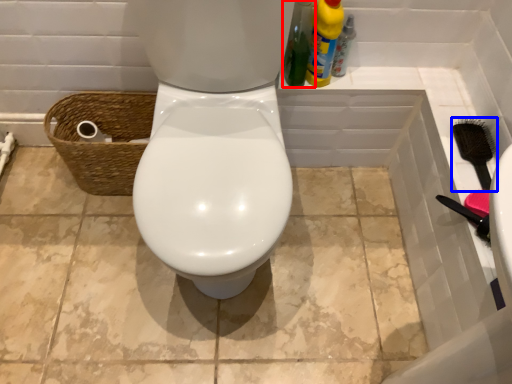
Question: Which point is closer to the camera, cleaning product (highlighted by a red box) or brush (highlighted by a blue box)?

Choices:
 (A) cleaning product
 (B) brush

Answer: (A)